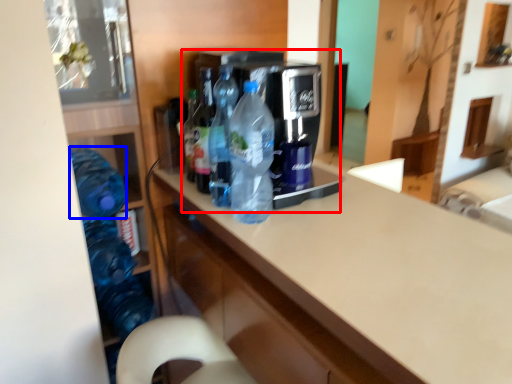
Question: Which point is further to the camera, appliance (highlighted by a red box) or bottle (highlighted by a blue box)?

Choices:
 (A) appliance
 (B) bottle

Answer: (B)